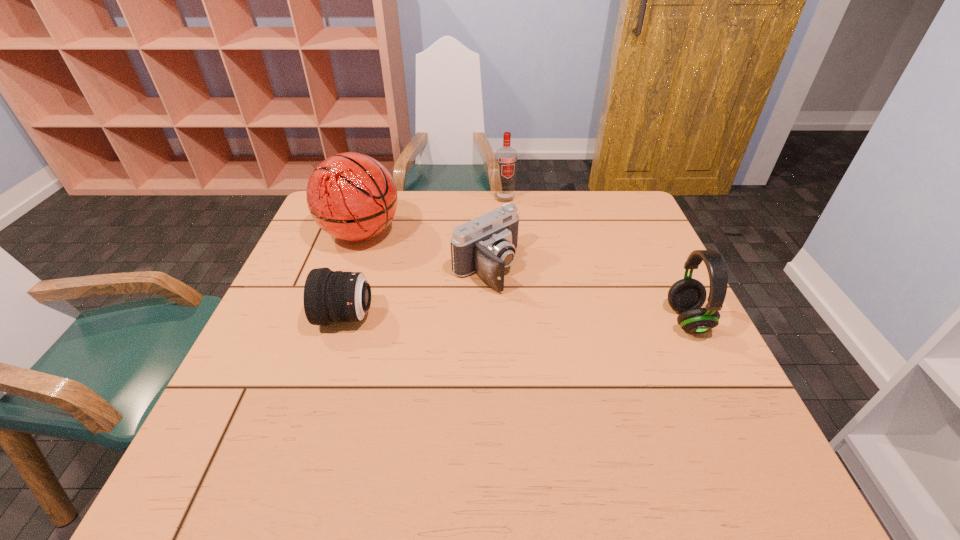
What are the coordinates of `vacant space on the desktop that is between the telephoto lens and the headset and is positioned on the side with spill of the basketball` in the screenshot? It's located at (498, 319).

You are a GUI agent. You are given a task and a screenshot of the screen. Output one action in this format:
    pyautogui.click(x=<x>, y=<y>)
    Task: Click on the free space on the desktop that is between the telephoto lens and the headset and is positioned at the front of the camera with an open lens cover
    
    Given the screenshot: What is the action you would take?
    pyautogui.click(x=551, y=319)

Locate an element on the screen. vacant spot on the desktop that is between the telephoto lens and the third tallest object and is positioned on the front label of the farthest object is located at coordinates (558, 319).